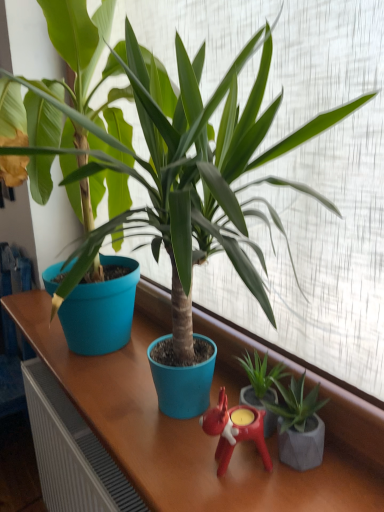
The image size is (384, 512). What do you see at coordinates (261, 387) in the screenshot? I see `green matte plant at center, which is counted as the second houseplant, starting from the left` at bounding box center [261, 387].

Measure the distance between green matte plant at center, the 2th houseplant in the right-to-left sequence, and camera.

30.84 inches.

At what (x,y) coordinates should I click in order to perform the action: click on green matte plant at lower right, which appears as the third houseplant when viewed from the left. Please return your answer as a coordinate pair (x, y). This screenshot has height=512, width=384. Looking at the image, I should click on (299, 425).

Image resolution: width=384 pixels, height=512 pixels. Describe the element at coordinates (95, 307) in the screenshot. I see `matte blue pot at center, which ranks as the first houseplant in left-to-right order` at that location.

Locate an element on the screen. The height and width of the screenshot is (512, 384). rubberized red candle holder at center is located at coordinates (234, 430).

In the scene shown: How distant is green matte plant at lower right, which appears as the third houseplant when viewed from the left, from rubberized red candle holder at center?

A distance of 7.60 centimeters exists between green matte plant at lower right, which appears as the third houseplant when viewed from the left, and rubberized red candle holder at center.

In the image, is green matte plant at lower right, the 1th houseplant viewed from the right, positioned in front of or behind rubberized red candle holder at center?

In the image, green matte plant at lower right, the 1th houseplant viewed from the right, appears in front of rubberized red candle holder at center.

Is green matte plant at lower right, which appears as the third houseplant when viewed from the left, taller than rubberized red candle holder at center?

Incorrect, the height of green matte plant at lower right, which appears as the third houseplant when viewed from the left, is not larger of that of rubberized red candle holder at center.

From the picture: Could you tell me if green matte plant at lower right, which appears as the third houseplant when viewed from the left, is turned towards rubberized red candle holder at center?

Yes, green matte plant at lower right, which appears as the third houseplant when viewed from the left, is aimed at rubberized red candle holder at center.

Does rubberized red candle holder at center touch matte blue pot at center, the third houseplant viewed from the right?

No, rubberized red candle holder at center is not with matte blue pot at center, the third houseplant viewed from the right.

Which of these two, rubberized red candle holder at center or matte blue pot at center, which ranks as the first houseplant in left-to-right order, is bigger?

Bigger between the two is matte blue pot at center, which ranks as the first houseplant in left-to-right order.

Which object is positioned more to the right, green matte plant at lower right, which appears as the third houseplant when viewed from the left, or green matte plant at center, which is counted as the second houseplant, starting from the left?

From the viewer's perspective, green matte plant at lower right, which appears as the third houseplant when viewed from the left, appears more on the right side.

From the image's perspective, which one is positioned higher, green matte plant at lower right, the 1th houseplant viewed from the right, or green matte plant at center, which is counted as the second houseplant, starting from the left?

green matte plant at center, which is counted as the second houseplant, starting from the left, is shown above in the image.

Locate an element on the screen. the 1st houseplant to the left when counting from the green matte plant at lower right, which appears as the third houseplant when viewed from the left is located at coordinates (261, 387).

Is there a large distance between green matte plant at lower right, which appears as the third houseplant when viewed from the left, and matte blue pot at center, the third houseplant viewed from the right?

green matte plant at lower right, which appears as the third houseplant when viewed from the left, is near matte blue pot at center, the third houseplant viewed from the right, not far away.

Is green matte plant at lower right, the 1th houseplant viewed from the right, to the left or to the right of matte blue pot at center, which ranks as the first houseplant in left-to-right order, in the image?

Based on their positions, green matte plant at lower right, the 1th houseplant viewed from the right, is located to the right of matte blue pot at center, which ranks as the first houseplant in left-to-right order.

Consider the image. Considering the relative sizes of green matte plant at lower right, the 1th houseplant viewed from the right, and matte blue pot at center, the third houseplant viewed from the right, in the image provided, is green matte plant at lower right, the 1th houseplant viewed from the right, taller than matte blue pot at center, the third houseplant viewed from the right,?

No.

Which point is more distant from viewer, (319, 408) or (109, 146)?

The point (109, 146) is more distant.

Who is more distant, matte blue pot at center, which ranks as the first houseplant in left-to-right order, or green matte plant at lower right, the 1th houseplant viewed from the right?

Positioned behind is green matte plant at lower right, the 1th houseplant viewed from the right.

Considering the sizes of objects matte blue pot at center, the third houseplant viewed from the right, and green matte plant at lower right, which appears as the third houseplant when viewed from the left, in the image provided, who is wider, matte blue pot at center, the third houseplant viewed from the right, or green matte plant at lower right, which appears as the third houseplant when viewed from the left,?

Wider between the two is matte blue pot at center, the third houseplant viewed from the right.

Locate an element on the screen. The height and width of the screenshot is (512, 384). the 2nd houseplant counting from the right of the matte blue pot at center, which ranks as the first houseplant in left-to-right order is located at coordinates (299, 425).

Is matte blue pot at center, the third houseplant viewed from the right, completely or partially outside of green matte plant at lower right, the 1th houseplant viewed from the right?

matte blue pot at center, the third houseplant viewed from the right, lies outside green matte plant at lower right, the 1th houseplant viewed from the right,'s area.

How far apart are matte blue pot at center, which ranks as the first houseplant in left-to-right order, and rubberized red candle holder at center?

matte blue pot at center, which ranks as the first houseplant in left-to-right order, and rubberized red candle holder at center are 25.54 inches apart from each other.

Is matte blue pot at center, the third houseplant viewed from the right, inside or outside of rubberized red candle holder at center?

matte blue pot at center, the third houseplant viewed from the right, is outside rubberized red candle holder at center.

Which object is thinner, matte blue pot at center, which ranks as the first houseplant in left-to-right order, or rubberized red candle holder at center?

With smaller width is rubberized red candle holder at center.

How many degrees apart are the facing directions of matte blue pot at center, which ranks as the first houseplant in left-to-right order, and rubberized red candle holder at center?

The facing directions of matte blue pot at center, which ranks as the first houseplant in left-to-right order, and rubberized red candle holder at center are 27.7 degrees apart.

Is matte blue pot at center, the third houseplant viewed from the right, to the left of green matte plant at center, which is counted as the second houseplant, starting from the left, from the viewer's perspective?

Correct, you'll find matte blue pot at center, the third houseplant viewed from the right, to the left of green matte plant at center, which is counted as the second houseplant, starting from the left.

This screenshot has height=512, width=384. I want to click on the 2nd houseplant behind the matte blue pot at center, the third houseplant viewed from the right, counting from the anchor's position, so click(x=261, y=387).

Can you confirm if matte blue pot at center, which ranks as the first houseplant in left-to-right order, is bigger than green matte plant at center, the 2th houseplant in the right-to-left sequence?

Correct, matte blue pot at center, which ranks as the first houseplant in left-to-right order, is larger in size than green matte plant at center, the 2th houseplant in the right-to-left sequence.

Is matte blue pot at center, the third houseplant viewed from the right, wider than green matte plant at center, which is counted as the second houseplant, starting from the left?

Yes, matte blue pot at center, the third houseplant viewed from the right, is wider than green matte plant at center, which is counted as the second houseplant, starting from the left.

Identify the location of miniature above the green matte plant at lower right, the 1th houseplant viewed from the right (from a real-world perspective). This screenshot has width=384, height=512. (234, 430).

Identify the location of houseplant that is on the left side of rubberized red candle holder at center. The height and width of the screenshot is (512, 384). (95, 307).

Estimate the real-world distances between objects in this image. Which object is closer to matte blue pot at center, which ranks as the first houseplant in left-to-right order, green matte plant at center, which is counted as the second houseplant, starting from the left, or rubberized red candle holder at center?

green matte plant at center, which is counted as the second houseplant, starting from the left, is closer to matte blue pot at center, which ranks as the first houseplant in left-to-right order.

Based on their spatial positions, is matte blue pot at center, the third houseplant viewed from the right, or rubberized red candle holder at center further from green matte plant at lower right, which appears as the third houseplant when viewed from the left?

matte blue pot at center, the third houseplant viewed from the right, is further to green matte plant at lower right, which appears as the third houseplant when viewed from the left.

Looking at this image, estimate the real-world distances between objects in this image. Which object is further from green matte plant at center, the 2th houseplant in the right-to-left sequence, matte blue pot at center, the third houseplant viewed from the right, or rubberized red candle holder at center?

The object further to green matte plant at center, the 2th houseplant in the right-to-left sequence, is matte blue pot at center, the third houseplant viewed from the right.

Estimate the real-world distances between objects in this image. Which object is further from matte blue pot at center, the third houseplant viewed from the right, green matte plant at center, which is counted as the second houseplant, starting from the left, or green matte plant at lower right, which appears as the third houseplant when viewed from the left?

Based on the image, green matte plant at lower right, which appears as the third houseplant when viewed from the left, appears to be further to matte blue pot at center, the third houseplant viewed from the right.

Looking at the image, which one is located closer to green matte plant at lower right, the 1th houseplant viewed from the right, green matte plant at center, which is counted as the second houseplant, starting from the left, or rubberized red candle holder at center?

Among the two, green matte plant at center, which is counted as the second houseplant, starting from the left, is located nearer to green matte plant at lower right, the 1th houseplant viewed from the right.

When comparing their distances from rubberized red candle holder at center, does matte blue pot at center, the third houseplant viewed from the right, or green matte plant at lower right, the 1th houseplant viewed from the right, seem closer?

The object closer to rubberized red candle holder at center is green matte plant at lower right, the 1th houseplant viewed from the right.

Estimate the real-world distances between objects in this image. Which object is closer to green matte plant at lower right, which appears as the third houseplant when viewed from the left, rubberized red candle holder at center or green matte plant at center, the 2th houseplant in the right-to-left sequence?

Based on the image, green matte plant at center, the 2th houseplant in the right-to-left sequence, appears to be nearer to green matte plant at lower right, which appears as the third houseplant when viewed from the left.

Looking at the image, which one is located closer to rubberized red candle holder at center, green matte plant at lower right, which appears as the third houseplant when viewed from the left, or green matte plant at center, which is counted as the second houseplant, starting from the left?

Among the two, green matte plant at lower right, which appears as the third houseplant when viewed from the left, is located nearer to rubberized red candle holder at center.

The width and height of the screenshot is (384, 512). What are the coordinates of `houseplant situated between matte blue pot at center, the third houseplant viewed from the right, and green matte plant at lower right, which appears as the third houseplant when viewed from the left, from left to right` in the screenshot? It's located at (261, 387).

This screenshot has width=384, height=512. Identify the location of houseplant situated between rubberized red candle holder at center and green matte plant at lower right, which appears as the third houseplant when viewed from the left, from left to right. (261, 387).